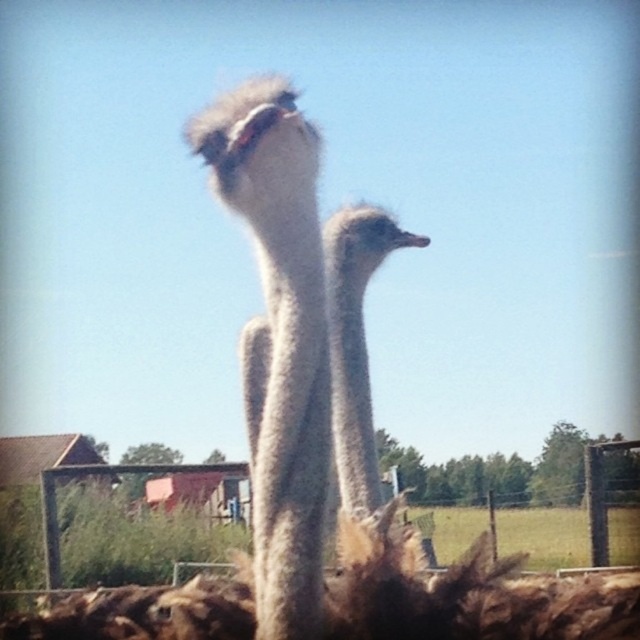
Between metal wire fence at center and white fluffy head at upper center, which one has less height?

Standing shorter between the two is white fluffy head at upper center.

Which is more to the right, metal wire fence at center or white fluffy head at upper center?

metal wire fence at center is more to the right.

The width and height of the screenshot is (640, 640). Identify the location of metal wire fence at center. (141, 524).

In order to click on metal wire fence at center in this screenshot , I will do `click(141, 524)`.

Is metal wire fence at center taller than white feathered ostrich at center?

Indeed, metal wire fence at center has a greater height compared to white feathered ostrich at center.

Measure the distance from metal wire fence at center to white feathered ostrich at center.

metal wire fence at center and white feathered ostrich at center are 5.82 meters apart.

Locate an element on the screen. Image resolution: width=640 pixels, height=640 pixels. metal wire fence at center is located at coordinates (141, 524).

Between white feathered ostrich at center and white fluffy head at upper center, which one is positioned higher?

white fluffy head at upper center

Can you confirm if white feathered ostrich at center is positioned below white fluffy head at upper center?

Yes.

Between point (353, 374) and point (260, 128), which one is positioned behind?

Point (353, 374)

Where is `white feathered ostrich at center`? white feathered ostrich at center is located at coordinates (355, 342).